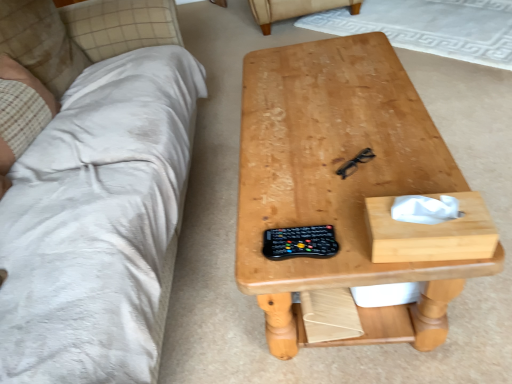
In order to click on white soft pillow at upper left in this screenshot , I will do `click(41, 43)`.

This screenshot has height=384, width=512. Describe the element at coordinates (41, 43) in the screenshot. I see `white soft pillow at upper left` at that location.

The height and width of the screenshot is (384, 512). Describe the element at coordinates (294, 9) in the screenshot. I see `beige fabric armchair at upper center` at that location.

I want to click on black plastic remote at center, so click(300, 242).

What do you see at coordinates (300, 242) in the screenshot? I see `black plastic remote at center` at bounding box center [300, 242].

Identify the location of natural wood table at center. (339, 183).

Considering the relative sizes of black plastic remote at center and beige fabric armchair at upper center in the image provided, is black plastic remote at center thinner than beige fabric armchair at upper center?

Correct, the width of black plastic remote at center is less than that of beige fabric armchair at upper center.

From the picture: From a real-world perspective, is black plastic remote at center located higher than beige fabric armchair at upper center?

Yes, from a real-world perspective, black plastic remote at center is over beige fabric armchair at upper center

At what (x,y) coordinates should I click in order to perform the action: click on control located in front of the beige fabric armchair at upper center. Please return your answer as a coordinate pair (x, y). The height and width of the screenshot is (384, 512). Looking at the image, I should click on (300, 242).

From a real-world perspective, is beige plaid fabric at left above or below natural wood table at center?

In terms of real-world spatial position, beige plaid fabric at left is above natural wood table at center.

Considering the sizes of objects beige plaid fabric at left and natural wood table at center in the image provided, who is thinner, beige plaid fabric at left or natural wood table at center?

With smaller width is beige plaid fabric at left.

Which is more to the left, beige plaid fabric at left or natural wood table at center?

Positioned to the left is beige plaid fabric at left.

Based on the photo, how many degrees apart are the facing directions of beige plaid fabric at left and natural wood table at center?

The angle between the facing direction of beige plaid fabric at left and the facing direction of natural wood table at center is 6.36 degrees.

Are beige plaid fabric at left and white soft pillow at upper left located far from each other?

No, beige plaid fabric at left is not far from white soft pillow at upper left.

From the image's perspective, relative to white soft pillow at upper left, is beige plaid fabric at left above or below?

beige plaid fabric at left is below white soft pillow at upper left.

Considering the positions of objects beige plaid fabric at left and white soft pillow at upper left in the image provided, who is in front, beige plaid fabric at left or white soft pillow at upper left?

beige plaid fabric at left is in front.

Which of these two, beige plaid fabric at left or white soft pillow at upper left, stands shorter?

With less height is beige plaid fabric at left.

Which is correct: natural wood table at center is inside beige fabric armchair at upper center, or outside of it?

natural wood table at center is not enclosed by beige fabric armchair at upper center.

Relative to beige fabric armchair at upper center, is natural wood table at center in front or behind?

In the image, natural wood table at center appears in front of beige fabric armchair at upper center.

Can you confirm if natural wood table at center is thinner than beige fabric armchair at upper center?

Indeed, natural wood table at center has a lesser width compared to beige fabric armchair at upper center.

This screenshot has width=512, height=384. In order to click on table below the beige fabric armchair at upper center (from the image's perspective) in this screenshot , I will do `click(339, 183)`.

From the image's perspective, which one is positioned lower, beige plaid fabric at left or beige fabric armchair at upper center?

beige plaid fabric at left.

Which object is closer to the camera taking this photo, beige plaid fabric at left or beige fabric armchair at upper center?

beige plaid fabric at left.

Could beige fabric armchair at upper center be considered to be inside beige plaid fabric at left?

No.

Is natural wood table at center to the left or to the right of beige plaid fabric at left in the image?

natural wood table at center is to the right of beige plaid fabric at left.

Based on the photo, in terms of width, does natural wood table at center look wider or thinner when compared to beige plaid fabric at left?

Clearly, natural wood table at center has more width compared to beige plaid fabric at left.

In the scene shown: Would you say natural wood table at center is a long distance from beige plaid fabric at left?

That's not correct — natural wood table at center is a little close to beige plaid fabric at left.

From a real-world perspective, is white soft pillow at upper left physically above beige plaid fabric at left?

Correct, in the physical world, white soft pillow at upper left is higher than beige plaid fabric at left.

From the image's perspective, which one is positioned lower, white soft pillow at upper left or beige plaid fabric at left?

From the image's view, beige plaid fabric at left is below.

Considering the positions of point (63, 82) and point (2, 66), is point (63, 82) closer or farther from the camera than point (2, 66)?

Point (63, 82) is positioned farther from the camera compared to point (2, 66).

From the picture: Can you confirm if white soft pillow at upper left is shorter than beige plaid fabric at left?

In fact, white soft pillow at upper left may be taller than beige plaid fabric at left.

I want to click on control in front of the beige fabric armchair at upper center, so click(300, 242).

In order to click on table located underneath the beige plaid fabric at left (from a real-world perspective) in this screenshot , I will do `click(339, 183)`.

From the image, which object appears to be farther from natural wood table at center, beige fabric armchair at upper center or beige plaid fabric at left?

beige fabric armchair at upper center is further to natural wood table at center.

From the image, which object appears to be farther from black plastic remote at center, beige plaid fabric at left or natural wood table at center?

beige plaid fabric at left.

Looking at the image, which one is located further to black plastic remote at center, natural wood table at center or beige plaid fabric at left?

The object further to black plastic remote at center is beige plaid fabric at left.

Estimate the real-world distances between objects in this image. Which object is closer to black plastic remote at center, beige plaid fabric at left or beige fabric armchair at upper center?

beige plaid fabric at left.

Estimate the real-world distances between objects in this image. Which object is closer to white soft pillow at upper left, natural wood table at center or beige plaid fabric at left?

beige plaid fabric at left.

Which object lies further to the anchor point beige fabric armchair at upper center, black plastic remote at center or beige plaid fabric at left?

Based on the image, black plastic remote at center appears to be further to beige fabric armchair at upper center.

Estimate the real-world distances between objects in this image. Which object is further from beige plaid fabric at left, natural wood table at center or beige fabric armchair at upper center?

beige fabric armchair at upper center is positioned further to the anchor beige plaid fabric at left.

Considering their positions, is natural wood table at center positioned further to black plastic remote at center than white soft pillow at upper left?

Among the two, white soft pillow at upper left is located further to black plastic remote at center.

The image size is (512, 384). What are the coordinates of `pillow between black plastic remote at center and beige fabric armchair at upper center in the front-back direction` in the screenshot? It's located at (41, 43).

Where is `person between black plastic remote at center and beige fabric armchair at upper center along the z-axis`? The height and width of the screenshot is (384, 512). person between black plastic remote at center and beige fabric armchair at upper center along the z-axis is located at coordinates (20, 113).

Identify the location of pillow between beige plaid fabric at left and beige fabric armchair at upper center along the z-axis. This screenshot has height=384, width=512. (41, 43).

Find the location of `person between natural wood table at center and beige fabric armchair at upper center from front to back`. person between natural wood table at center and beige fabric armchair at upper center from front to back is located at coordinates (20, 113).